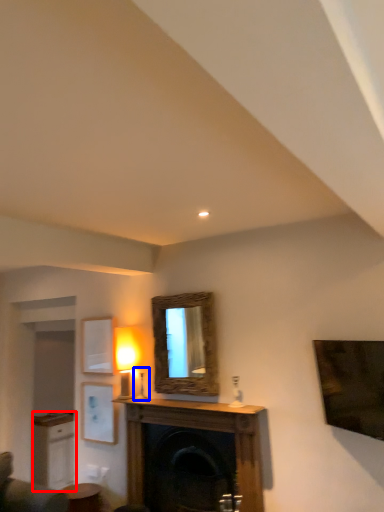
Question: Which object appears closest to the camera in this image, cabinetry (highlighted by a red box) or table lamp (highlighted by a blue box)?

Choices:
 (A) cabinetry
 (B) table lamp

Answer: (B)